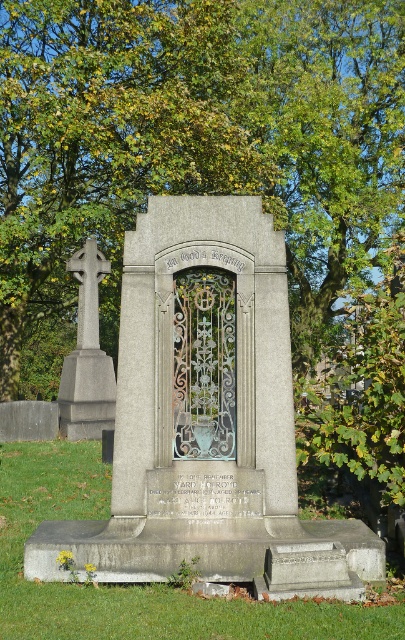
From the picture: Does gray stone monument at center come behind polished stone cross at left?

That is False.

Does point (149, 336) come closer to viewer compared to point (63, 394)?

That is True.

Locate an element on the screen. This screenshot has width=405, height=640. gray stone monument at center is located at coordinates (206, 420).

Image resolution: width=405 pixels, height=640 pixels. Describe the element at coordinates (191, 147) in the screenshot. I see `green leafy tree at upper center` at that location.

The height and width of the screenshot is (640, 405). Describe the element at coordinates (191, 147) in the screenshot. I see `green leafy tree at upper center` at that location.

Locate an element on the screen. This screenshot has height=640, width=405. green leafy tree at upper center is located at coordinates (191, 147).

Can you confirm if green leafy tree at upper center is positioned above gray stone monument at center?

Correct, green leafy tree at upper center is located above gray stone monument at center.

Measure the distance between point (296, 88) and camera.

20.02 meters

Locate an element on the screen. green leafy tree at upper center is located at coordinates (191, 147).